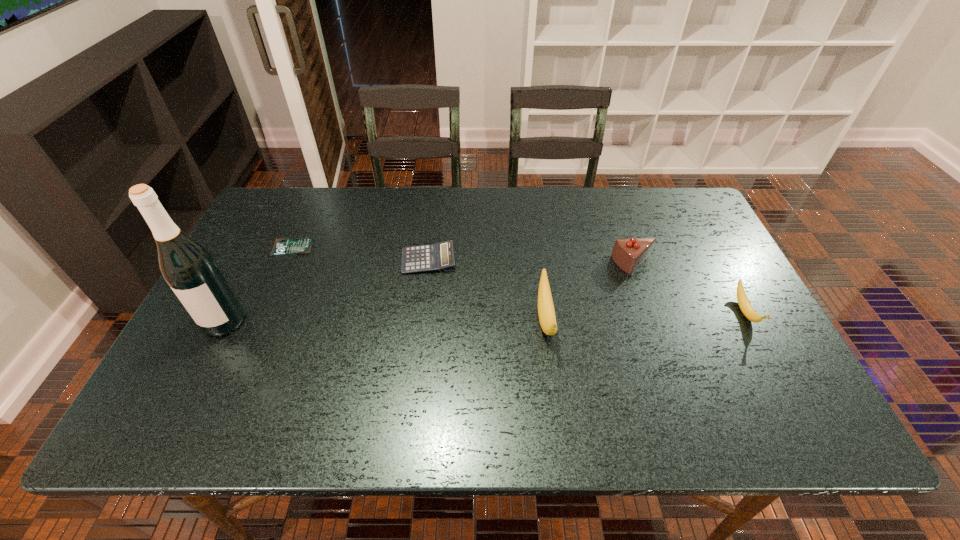
Identify the location of free space between the chocolate cake and the calculator. The image size is (960, 540). (531, 262).

Image resolution: width=960 pixels, height=540 pixels. I want to click on free point between the fifth object from left to right and the wine bottle, so click(429, 293).

Locate an element on the screen. Image resolution: width=960 pixels, height=540 pixels. free space between the second shortest object and the second object from right to left is located at coordinates (531, 262).

Locate an element on the screen. This screenshot has height=540, width=960. the fourth closest object to the tallest object is located at coordinates (628, 254).

Select which object appears as the fifth closest to the calculator. Please provide its 2D coordinates. Your answer should be formatted as a tuple, i.e. [(x, y)], where the tuple contains the x and y coordinates of a point satisfying the conditions above.

[(743, 302)]

This screenshot has width=960, height=540. Find the location of `free space that satisfies the following two spatial constraints: 1. on the front side of the identity card; 2. on the left side of the chocolate cake`. free space that satisfies the following two spatial constraints: 1. on the front side of the identity card; 2. on the left side of the chocolate cake is located at coordinates (284, 265).